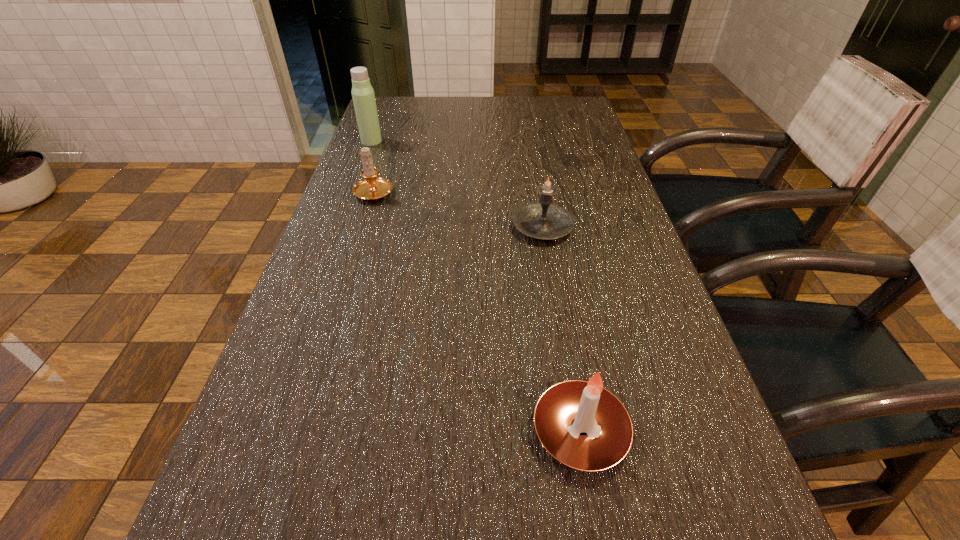
Locate an element on the screen. thermos bottle is located at coordinates (363, 96).

Where is `the tallest object`? This screenshot has width=960, height=540. the tallest object is located at coordinates (363, 96).

Where is `the nearest candle`? the nearest candle is located at coordinates (581, 424).

Locate an element on the screen. the third farthest object is located at coordinates (542, 220).

Image resolution: width=960 pixels, height=540 pixels. In order to click on the farthest candle in this screenshot , I will do `click(371, 188)`.

Where is `the leftmost candle`? the leftmost candle is located at coordinates (371, 188).

Identify the location of free location located on the back of the farthest object. (379, 120).

Image resolution: width=960 pixels, height=540 pixels. In order to click on free space located on the left of the nearest object in this screenshot , I will do `click(358, 431)`.

I want to click on blank space located on the back of the third farthest object, so click(x=534, y=174).

Where is `free location located on the right of the farthest candle`? free location located on the right of the farthest candle is located at coordinates (438, 191).